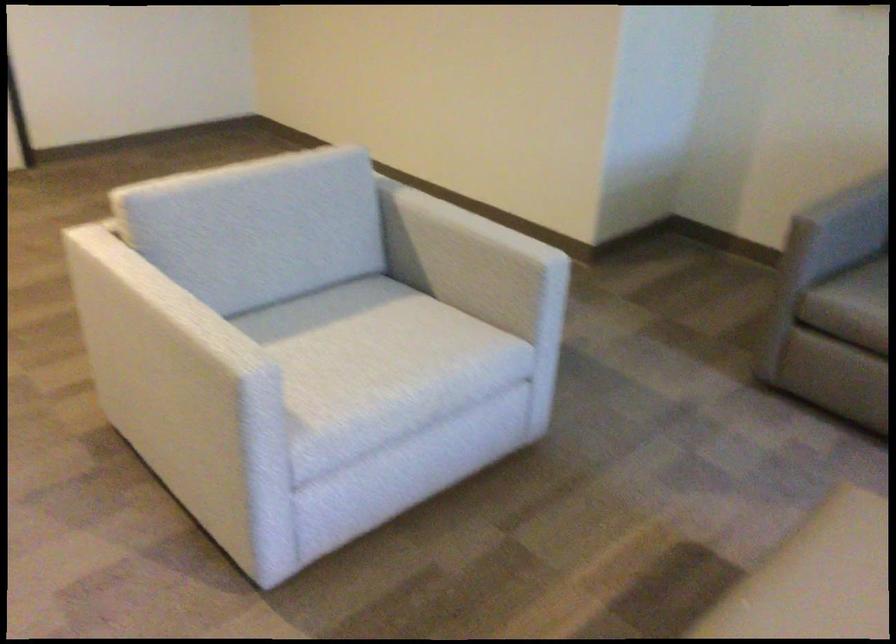
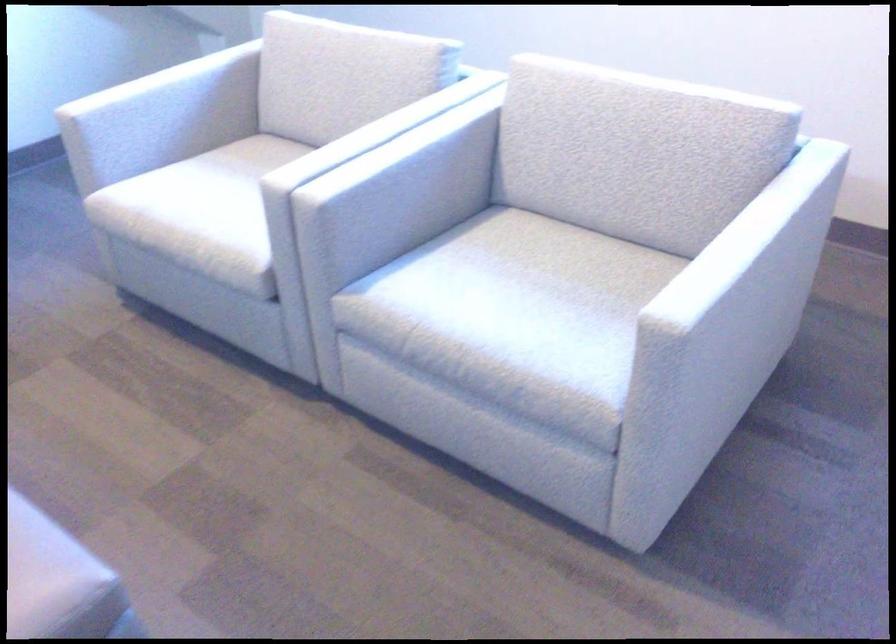
Based on the continuous images, in which direction is the camera rotating?

The camera rotated toward right-down.